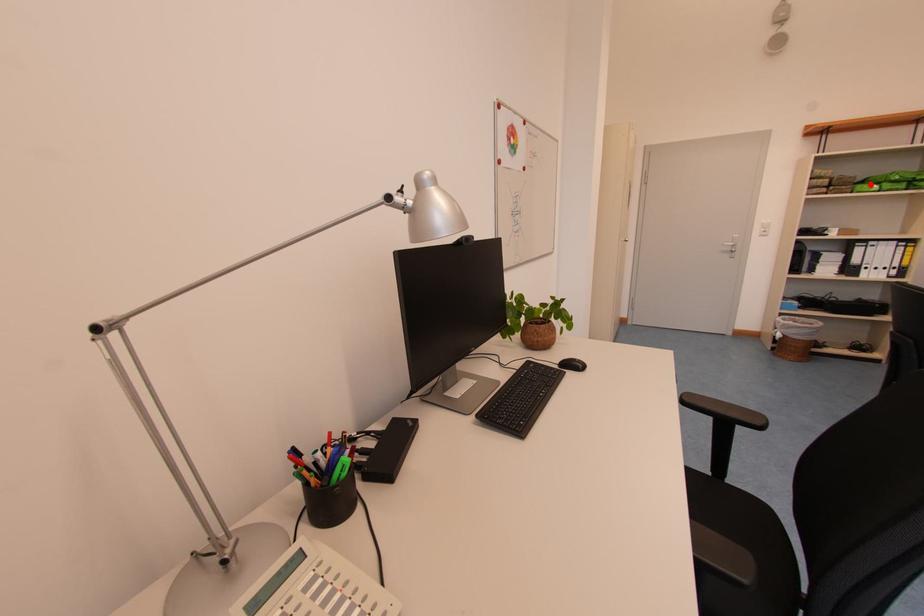
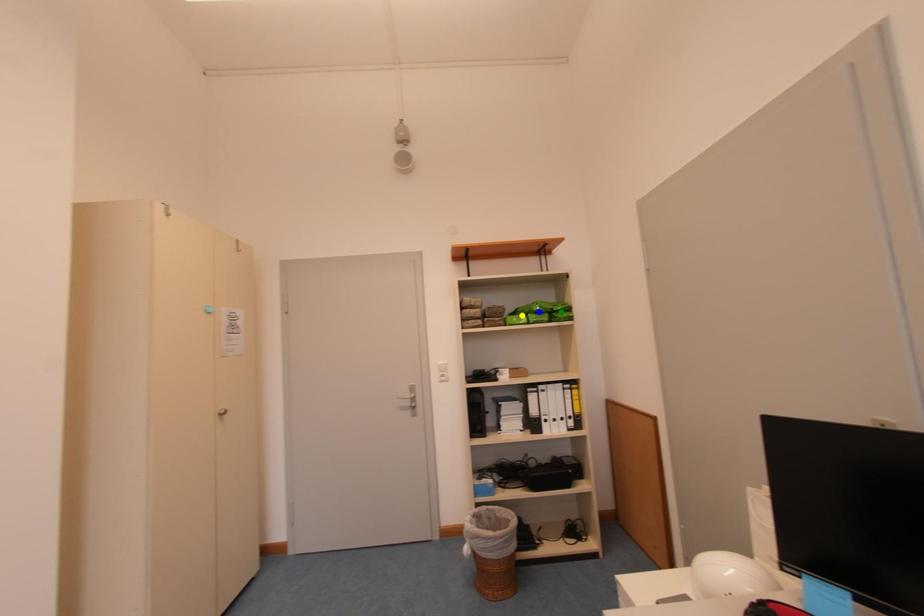
Question: I am providing you with two images of the same scene from different viewpoints. A red point is marked on the first image. You are given multiple points on the second image. Which point in image 2 is actually the same real-world point as the red point in image 1?

Choices:
 (A) blue point
 (B) green point
 (C) yellow point

Answer: (C)